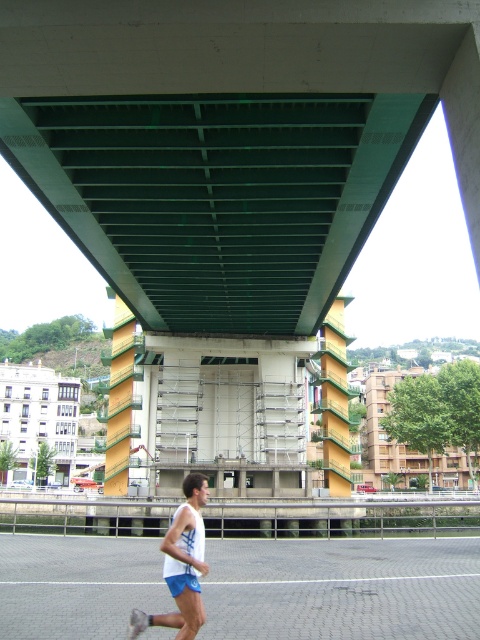
In the scene shown: You are a pedestrian standing on the path and see the green painted steel bridge at upper center and the white matte tank top at lower center. Which object is closer to you?

The white matte tank top at lower center is behind the green painted steel bridge at upper center, so the green painted steel bridge at upper center is closer to you.

A delivery truck that is 3.5 meters wide needs to pass through the gap between the green painted steel bridge at upper center and the multi story building under construction. Can it fit through the gap?

The gap between the green painted steel bridge at upper center and the multi story building under construction is 7.93 meters, which is wider than the truck width of 3.5 meters. The truck can safely pass through the gap.

You are standing at the point closer to the bridge in the scene. Which point are you at, point (312,67) or point (181,522)?

You are at point (312,67) because it is closer to the bridge, which is in the upper portion of the frame.